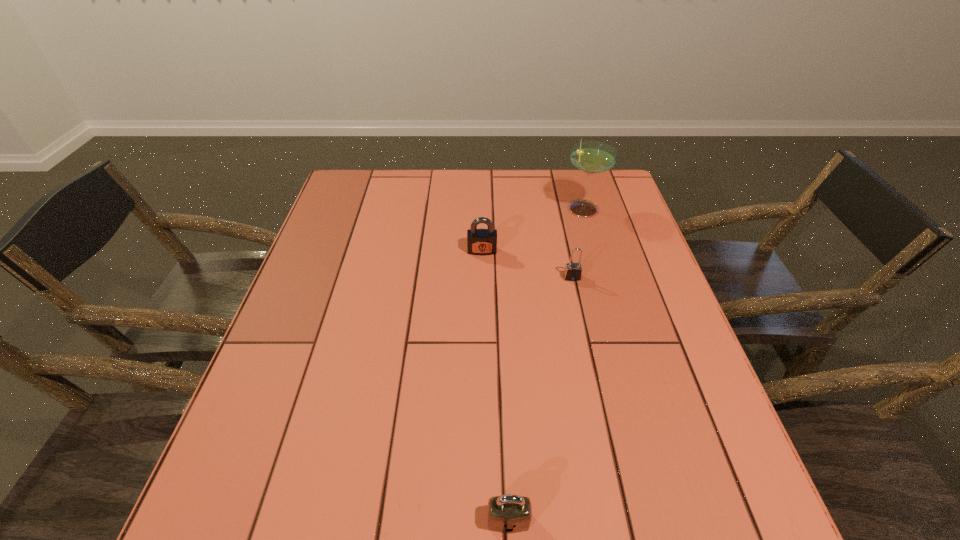
Where is `the tallest object`? The height and width of the screenshot is (540, 960). the tallest object is located at coordinates (591, 157).

At what (x,y) coordinates should I click in order to perform the action: click on the farthest object. Please return your answer as a coordinate pair (x, y). Looking at the image, I should click on 591,157.

You are a GUI agent. You are given a task and a screenshot of the screen. Output one action in this format:
    pyautogui.click(x=<x>, y=<y>)
    Task: Click on the farthest padlock
    The height and width of the screenshot is (540, 960).
    Given the screenshot: What is the action you would take?
    pyautogui.click(x=481, y=242)

At what (x,y) coordinates should I click in order to perform the action: click on the second nearest object. Please return your answer as a coordinate pair (x, y). This screenshot has width=960, height=540. Looking at the image, I should click on (573, 271).

The height and width of the screenshot is (540, 960). In order to click on the rightmost padlock in this screenshot , I will do `click(573, 271)`.

Identify the location of the nearest padlock. This screenshot has height=540, width=960. tap(510, 513).

I want to click on vacant space positioned on the front of the farthest object, so (x=611, y=304).

You are a GUI agent. You are given a task and a screenshot of the screen. Output one action in this format:
    pyautogui.click(x=<x>, y=<y>)
    Task: Click on the vacant space located on the front of the farthest padlock near the keyhole
    
    Given the screenshot: What is the action you would take?
    pyautogui.click(x=482, y=315)

In order to click on vacant space located 0.270m on the shackle of the rightmost padlock in this screenshot , I will do `click(592, 372)`.

Identify the location of object that is at the far edge. [x=591, y=157].